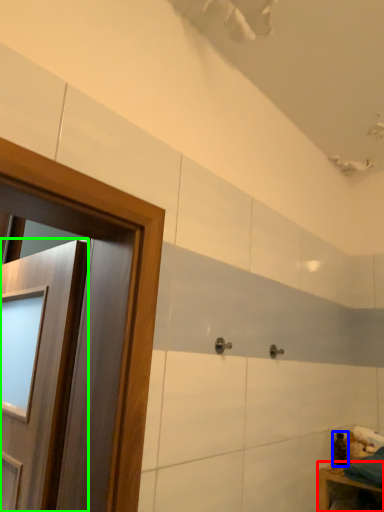
Question: Which object is the closest to the furniture (highlighted by a red box)? Choose among these: toiletry (highlighted by a blue box) or door (highlighted by a green box).

Choices:
 (A) toiletry
 (B) door

Answer: (A)